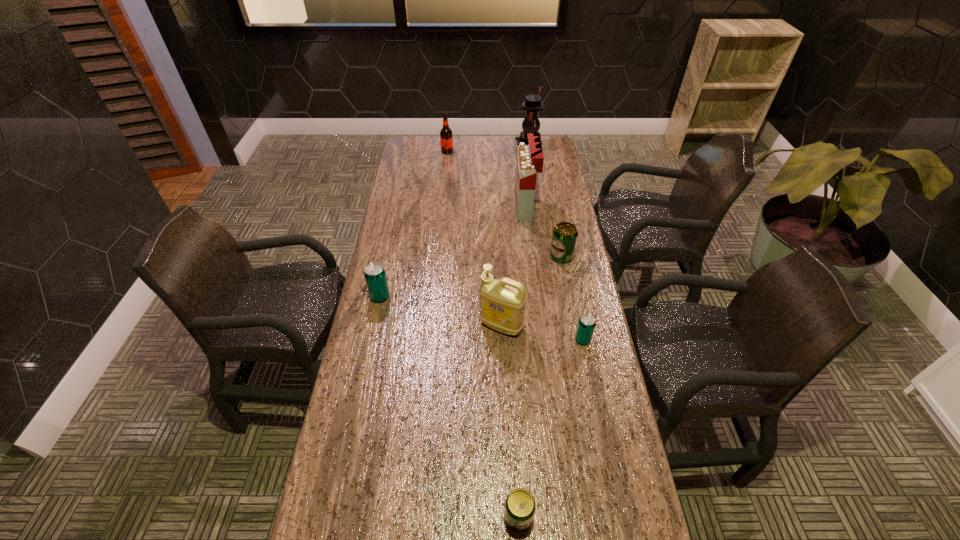
I want to click on the left teal beer can, so click(375, 276).

Where is `the nearest beer can`? the nearest beer can is located at coordinates (520, 505).

Locate an element on the screen. The image size is (960, 540). the nearer green beer can is located at coordinates point(520,505).

Find the location of `the nearer teal beer can`. the nearer teal beer can is located at coordinates (586, 324).

Locate an element on the screen. Image resolution: width=960 pixels, height=540 pixels. the second nearest beer can is located at coordinates (586, 324).

Where can I find a free point located 0.130m above the black lantern, indicating its light source? Please provide its 2D coordinates. Your answer should be formatted as a tuple, i.e. [(x, y)], where the tuple contains the x and y coordinates of a point satisfying the conditions above.

[(489, 144)]

Where can I find a free point located 0.220m above the black lantern, indicating its light source? Please provide its 2D coordinates. Your answer should be formatted as a tuple, i.e. [(x, y)], where the tuple contains the x and y coordinates of a point satisfying the conditions above.

[(471, 144)]

Pinpoint the vacant space located 0.120m above the black lantern, indicating its light source. Please provide its 2D coordinates. Your answer should be formatted as a tuple, i.e. [(x, y)], where the tuple contains the x and y coordinates of a point satisfying the conditions above.

[(491, 144)]

You are a GUI agent. You are given a task and a screenshot of the screen. Output one action in this format:
    pyautogui.click(x=<x>, y=<y>)
    Task: Click on the free region located 0.170m with the lid open on the red cigarette case
    The width and height of the screenshot is (960, 540).
    Given the screenshot: What is the action you would take?
    pyautogui.click(x=475, y=208)

Locate an element on the screen. The image size is (960, 540). vacant space situated 0.350m with the lid open on the red cigarette case is located at coordinates [432, 208].